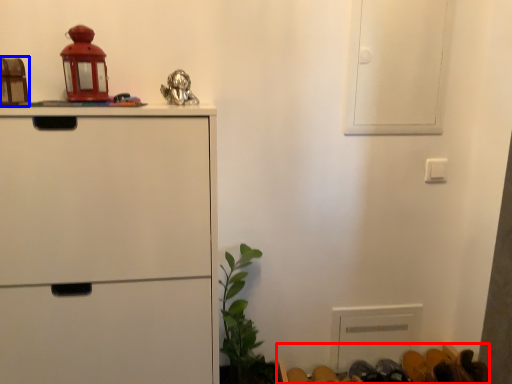
Question: Among these objects, which one is farthest to the camera, furniture (highlighted by a red box) or toy (highlighted by a blue box)?

Choices:
 (A) furniture
 (B) toy

Answer: (A)